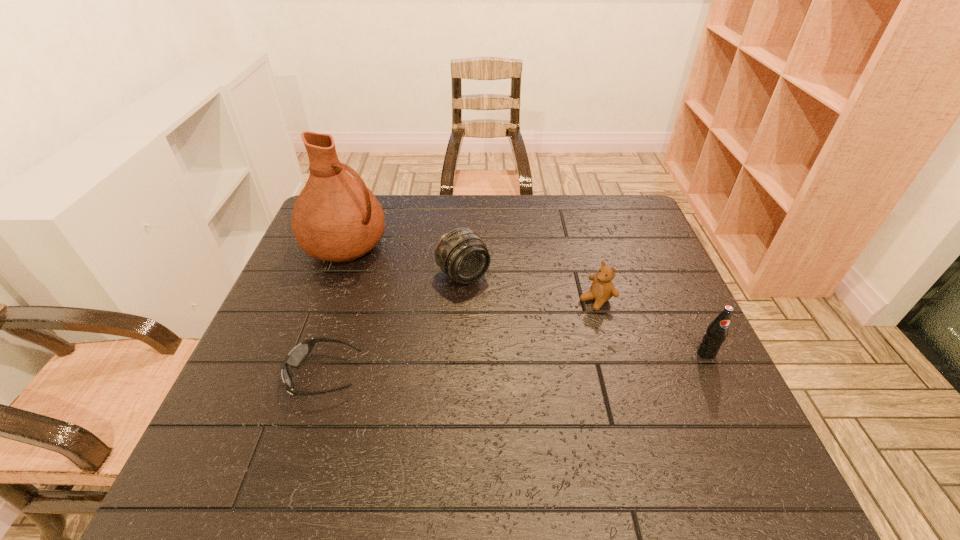
Find the location of a particular element. The width and height of the screenshot is (960, 540). vacant space located 0.070m on the side of the tallest object with the handle is located at coordinates (396, 271).

Find the location of a particular element. free space located on the side of the tallest object with the handle is located at coordinates (457, 301).

This screenshot has width=960, height=540. Identify the location of free spot located 0.310m on the side of the tallest object with the handle. (467, 306).

Find the location of a particular element. This screenshot has width=960, height=540. vacant space positioned 0.250m on the front-facing side of the second object from right to left is located at coordinates (511, 359).

Locate an element on the screen. This screenshot has width=960, height=540. free space located 0.300m on the front-facing side of the second object from right to left is located at coordinates (494, 370).

This screenshot has height=540, width=960. What are the coordinates of `vacant region located on the front-facing side of the second object from right to left` in the screenshot? It's located at (571, 317).

Locate an element on the screen. The image size is (960, 540). object at the far edge is located at coordinates (336, 218).

Locate an element on the screen. The image size is (960, 540). object present at the near edge is located at coordinates (298, 354).

Where is `sunglasses present at the left edge`? sunglasses present at the left edge is located at coordinates (298, 354).

Where is `pitcher that is at the left edge`? The width and height of the screenshot is (960, 540). pitcher that is at the left edge is located at coordinates (336, 218).